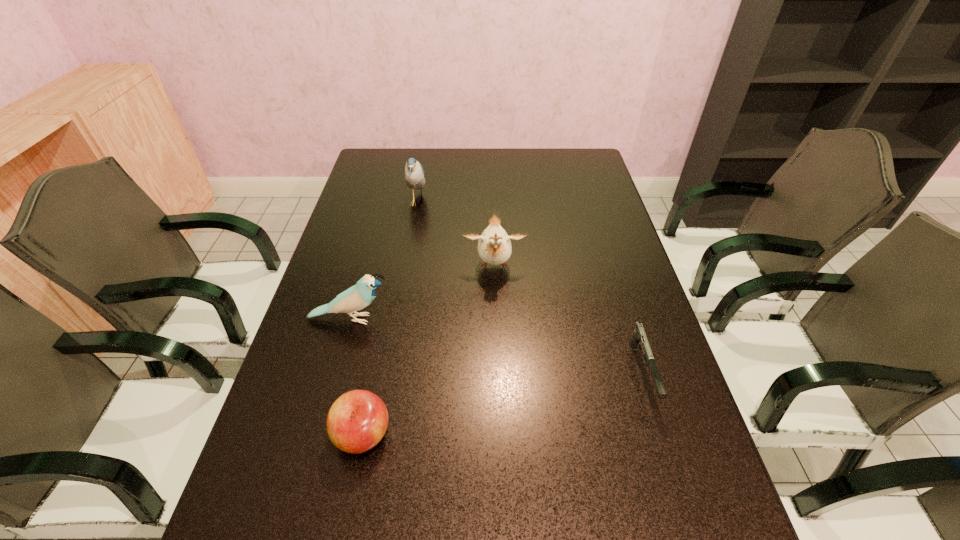
Locate which object ranks second in proximity to the shortest object. Please provide its 2D coordinates. Your answer should be formatted as a tuple, i.e. [(x, y)], where the tuple contains the x and y coordinates of a point satisfying the conditions above.

[(357, 421)]

Select which object is the third closest to the fourth tallest object. Please provide its 2D coordinates. Your answer should be formatted as a tuple, i.e. [(x, y)], where the tuple contains the x and y coordinates of a point satisfying the conditions above.

[(639, 338)]

The width and height of the screenshot is (960, 540). What are the coordinates of `bird identified as the second closest to the farthest bird` in the screenshot? It's located at (357, 297).

Locate an element on the screen. Image resolution: width=960 pixels, height=540 pixels. bird that is the second closest one to the second shortest object is located at coordinates (494, 246).

What are the coordinates of `free location that satisfies the following two spatial constraints: 1. at the face of the third farthest object; 2. on the back side of the apple` in the screenshot? It's located at (319, 435).

The width and height of the screenshot is (960, 540). In order to click on vacant region that satisfies the following two spatial constraints: 1. at the face of the third farthest object; 2. on the left side of the apple in this screenshot , I will do `click(319, 435)`.

This screenshot has height=540, width=960. In order to click on vacant area that satisfies the following two spatial constraints: 1. at the tip of the farthest object's beak; 2. on the front side of the fourth tallest object in this screenshot , I will do `click(375, 435)`.